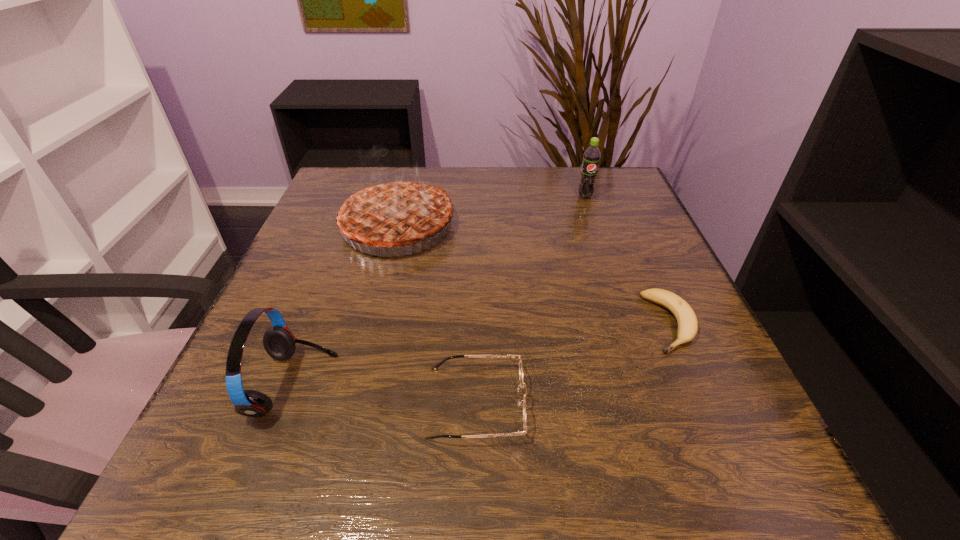
The image size is (960, 540). In order to click on vacant space at the far edge of the desktop in this screenshot , I will do pos(564,213).

Identify the location of vacant point at the near edge. The height and width of the screenshot is (540, 960). (641, 494).

Locate an element on the screen. This screenshot has width=960, height=540. vacant space at the left edge of the desktop is located at coordinates (291, 311).

Find the location of a particular element. vacant area at the right edge is located at coordinates (654, 324).

The image size is (960, 540). What are the coordinates of `vacant space at the near left corner of the desktop` in the screenshot? It's located at (285, 448).

Locate an element on the screen. free space at the far right corner is located at coordinates (594, 192).

The width and height of the screenshot is (960, 540). I want to click on blank area at the near right corner, so click(691, 448).

At what (x,y) coordinates should I click in order to perform the action: click on free space between the third tallest object and the soda. Please return your answer as a coordinate pair (x, y). Looking at the image, I should click on (440, 291).

Identify the location of free space that is in between the rightmost object and the tallest object. Image resolution: width=960 pixels, height=540 pixels. (534, 275).

This screenshot has height=540, width=960. Identify the location of vacant area that lies between the spectacles and the third tallest object. (385, 394).